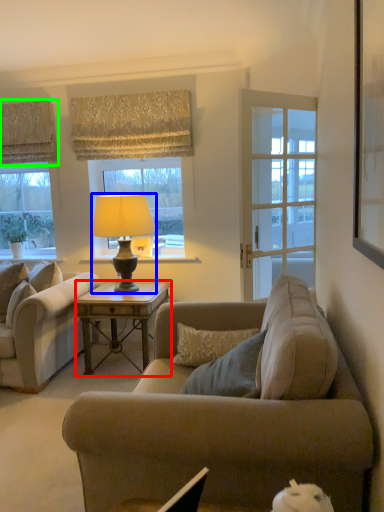
Question: Based on their relative distances, which object is nearer to desk (highlighted by a red box)? Choose from lamp (highlighted by a blue box) and curtain (highlighted by a green box).

Choices:
 (A) lamp
 (B) curtain

Answer: (A)